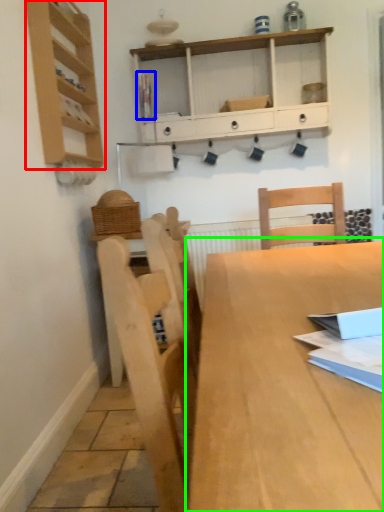
Question: Which is nearer to the shelf (highlighted by a red box)? book (highlighted by a blue box) or table (highlighted by a green box).

Choices:
 (A) book
 (B) table

Answer: (A)